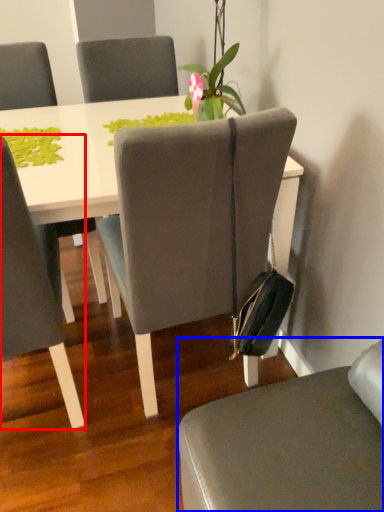
Question: Which object is closer to the camera taking this photo, chair (highlighted by a red box) or chair (highlighted by a blue box)?

Choices:
 (A) chair
 (B) chair

Answer: (B)